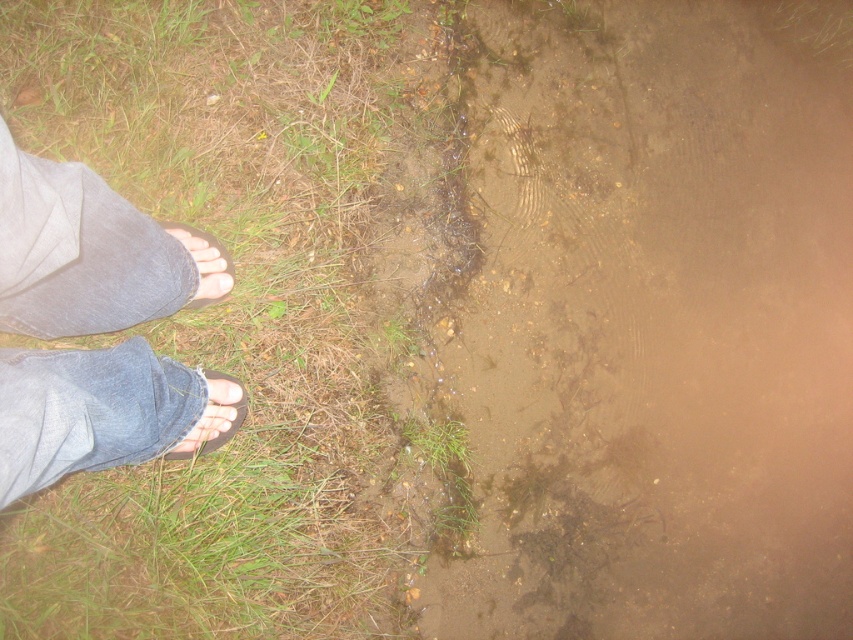
Can you confirm if brown muddy water at lower left is shorter than denim jeans at lower left?

Incorrect, brown muddy water at lower left's height does not fall short of denim jeans at lower left's.

What do you see at coordinates (651, 324) in the screenshot?
I see `brown muddy water at lower left` at bounding box center [651, 324].

Identify the location of brown muddy water at lower left. (651, 324).

Between denim sandal at lower left and brown leather sandal at lower left, which one has less height?

denim sandal at lower left

Is point (215, 380) behind point (160, 221)?

That is False.

The image size is (853, 640). Find the location of `denim sandal at lower left`. denim sandal at lower left is located at coordinates (213, 419).

Is point (73, 544) less distant than point (228, 280)?

Yes, it is.

Does point (296, 440) come farther from viewer compared to point (218, 282)?

Yes, it is.

Measure the distance between green grass at lower left and camera.

green grass at lower left is 5.33 feet from camera.

This screenshot has width=853, height=640. What are the coordinates of `green grass at lower left` in the screenshot? It's located at (242, 316).